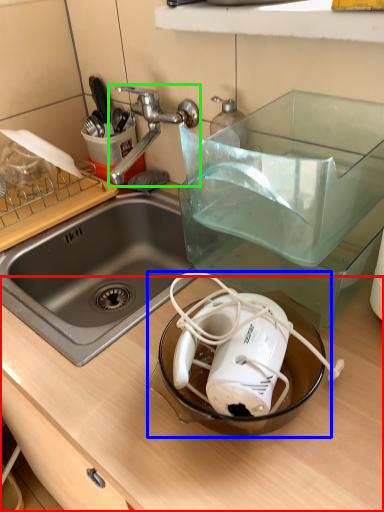
Question: Estimate the real-world distances between objects in this image. Which object is farther from counter top (highlighted by a red box), appliance (highlighted by a blue box) or tap (highlighted by a green box)?

Choices:
 (A) appliance
 (B) tap

Answer: (B)